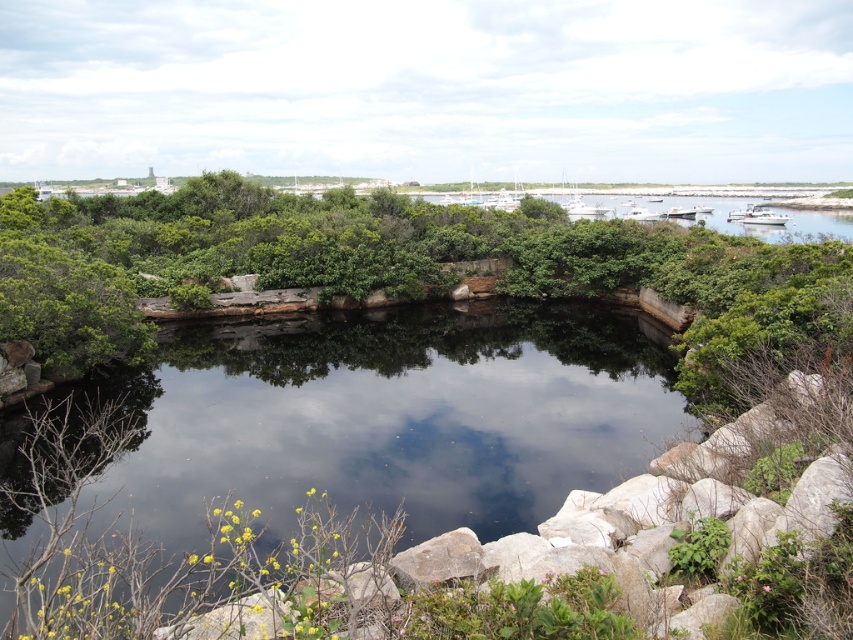
You are standing near the rocks in the foreground of the natural scene. You see the clear water at center and the green leafy river at upper center. Which object is located below the other?

The clear water at center is positioned under the green leafy river at upper center, meaning the clear water at center is below the green leafy river at upper center.